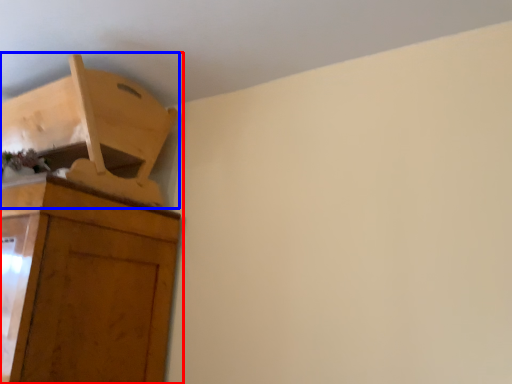
Question: Among these objects, which one is farthest to the camera, cupboard (highlighted by a red box) or furniture (highlighted by a blue box)?

Choices:
 (A) cupboard
 (B) furniture

Answer: (B)